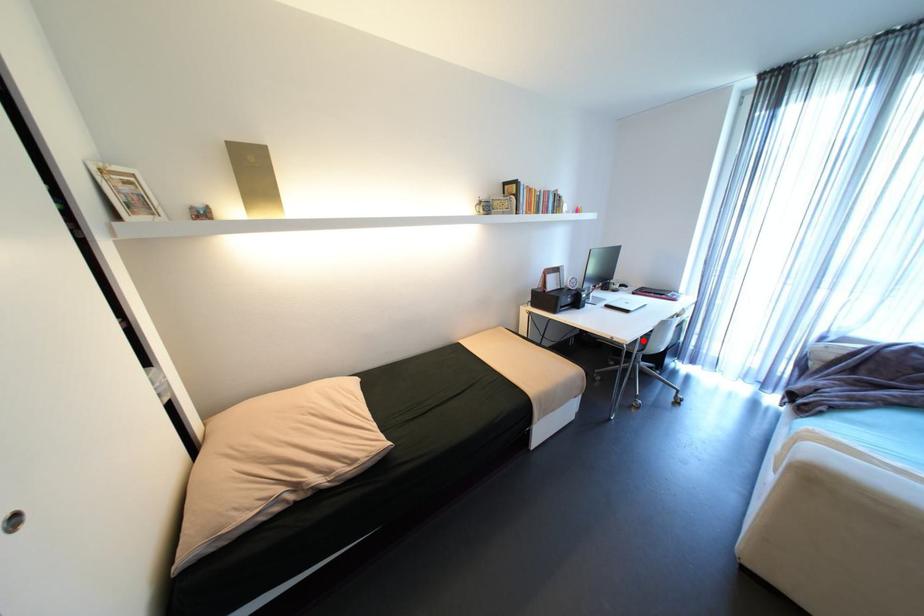
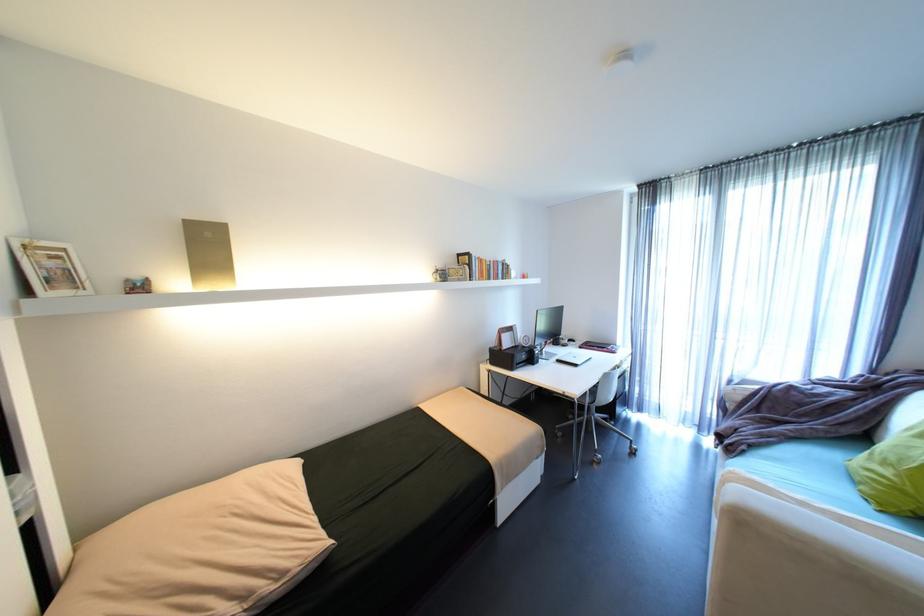
In the second image, find the point that corresponds to the highlighted location in the first image.

(592, 394)